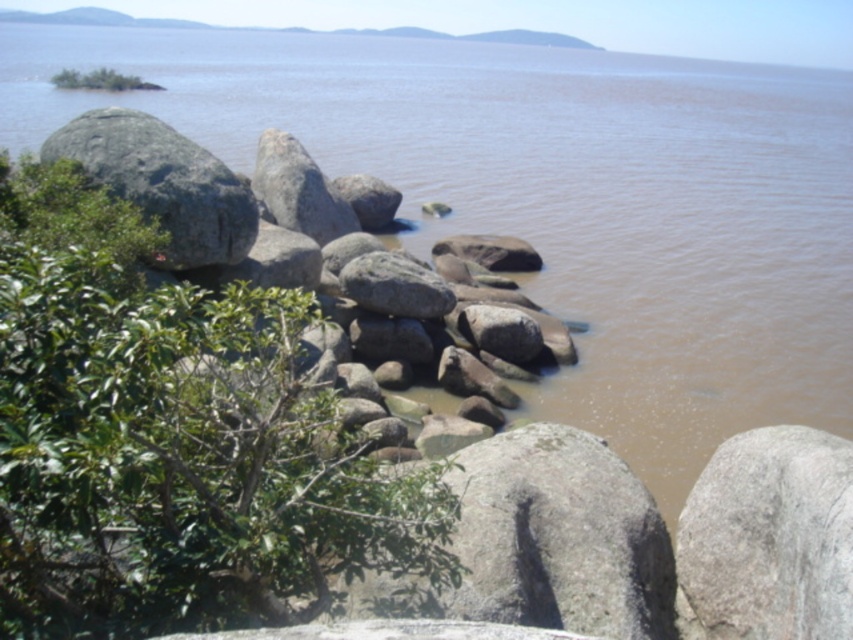
Between gray rough rock at center and gray granite rocks at center, which one is positioned lower?

gray rough rock at center is lower down.

Is gray rough rock at center shorter than gray granite rocks at center?

Yes, gray rough rock at center is shorter than gray granite rocks at center.

What do you see at coordinates (769, 538) in the screenshot? I see `gray rough rock at center` at bounding box center [769, 538].

Locate an element on the screen. The image size is (853, 640). gray rough rock at center is located at coordinates (769, 538).

Is gray rough rock at center taller than gray rough rock at left?

Indeed, gray rough rock at center has a greater height compared to gray rough rock at left.

Describe the element at coordinates (769, 538) in the screenshot. I see `gray rough rock at center` at that location.

From the picture: Measure the distance between gray rough rock at center and camera.

They are 3.76 meters apart.

Find the location of a particular element. Image resolution: width=853 pixels, height=640 pixels. gray rough rock at center is located at coordinates (769, 538).

Is gray granite rocks at center to the right of gray rough rock at left from the viewer's perspective?

Correct, you'll find gray granite rocks at center to the right of gray rough rock at left.

Who is more forward, (228,257) or (170,184)?

Positioned in front is point (170,184).

At what (x,y) coordinates should I click in order to perform the action: click on gray granite rocks at center. Please return your answer as a coordinate pair (x, y). The height and width of the screenshot is (640, 853). Looking at the image, I should click on (202, 193).